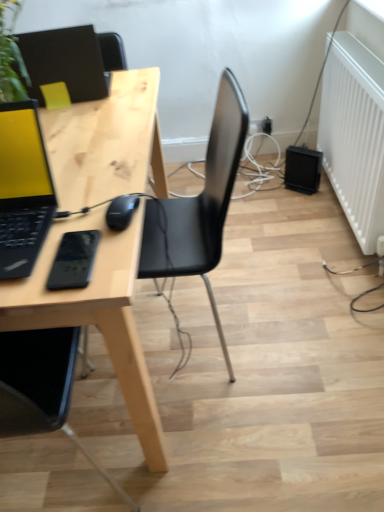
What are the coordinates of `blank area to the left of white matte radiator at right` in the screenshot? It's located at (284, 220).